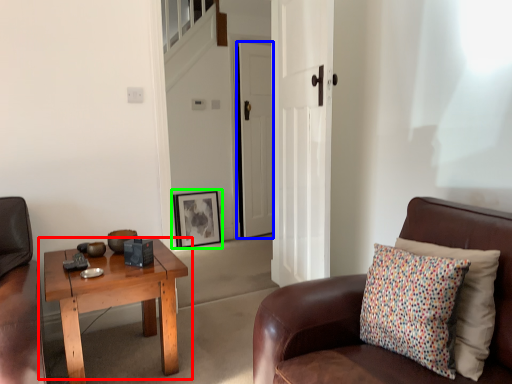
Question: Considering the real-world distances, which object is closest to coffee table (highlighted by a red box)? door (highlighted by a blue box) or picture frame (highlighted by a green box).

Choices:
 (A) door
 (B) picture frame

Answer: (B)